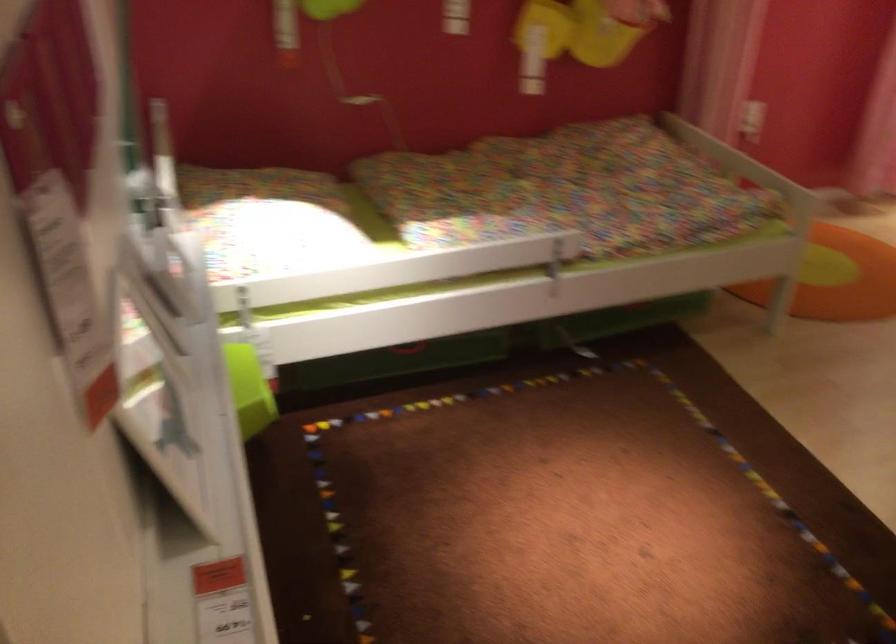
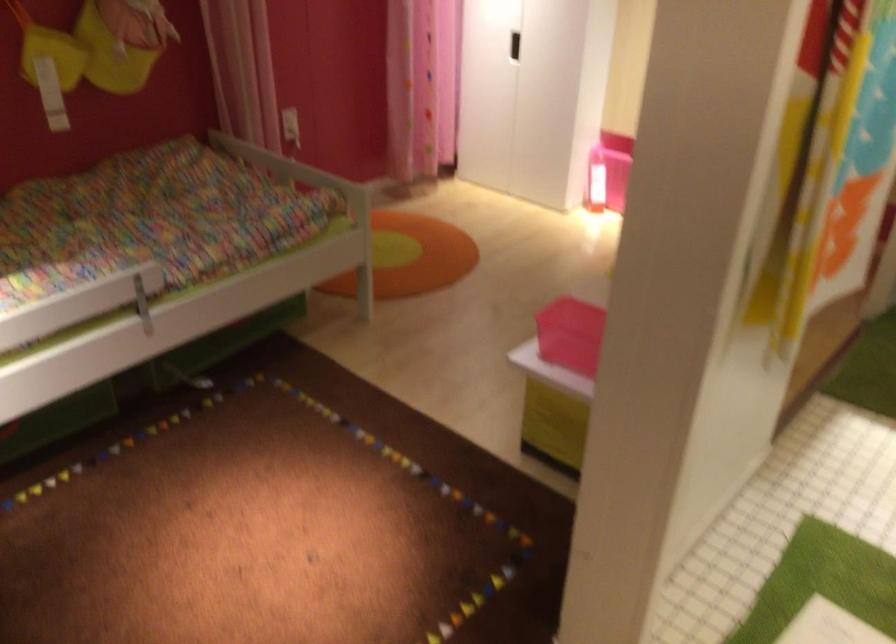
Question: The camera is either moving clockwise (left) or counter-clockwise (right) around the object. The first image is from the beginning of the video and the second image is from the end. Is the camera moving left or right when shooting the video?

Choices:
 (A) Left
 (B) Right

Answer: (A)